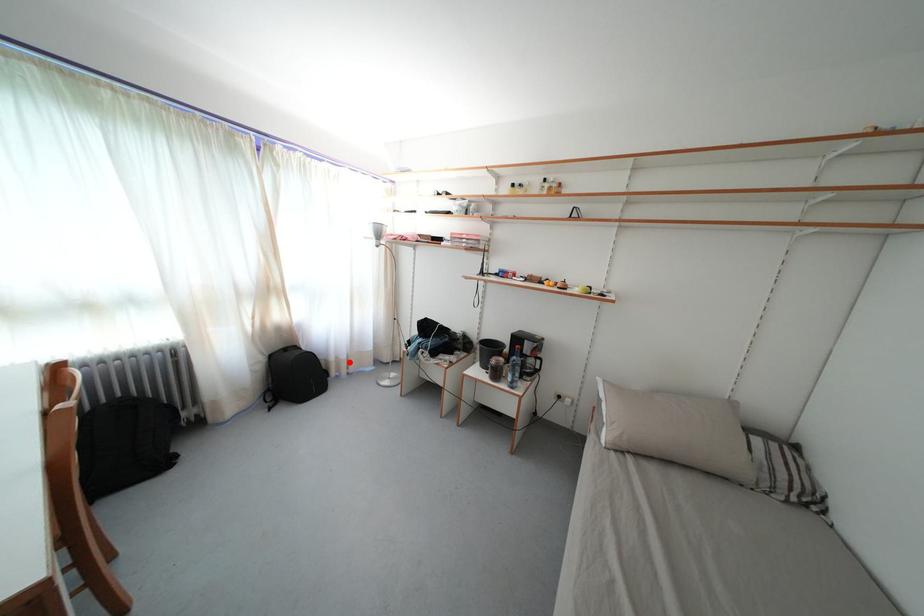
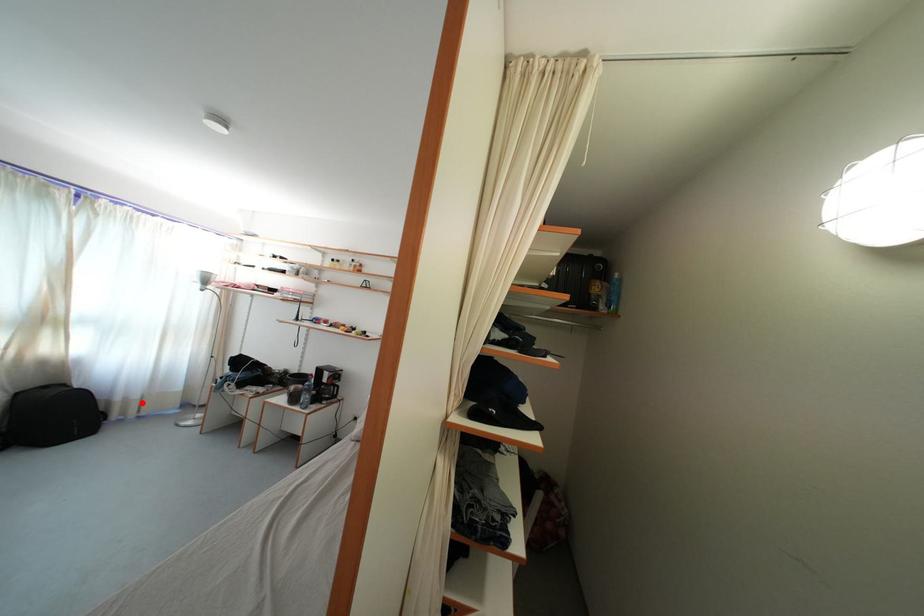
I am providing you with two images of the same scene from different viewpoints. A red point is marked on the first image and another point is marked on the second image. Does the point marked in image1 correspond to the same location as the one in image2?

Yes